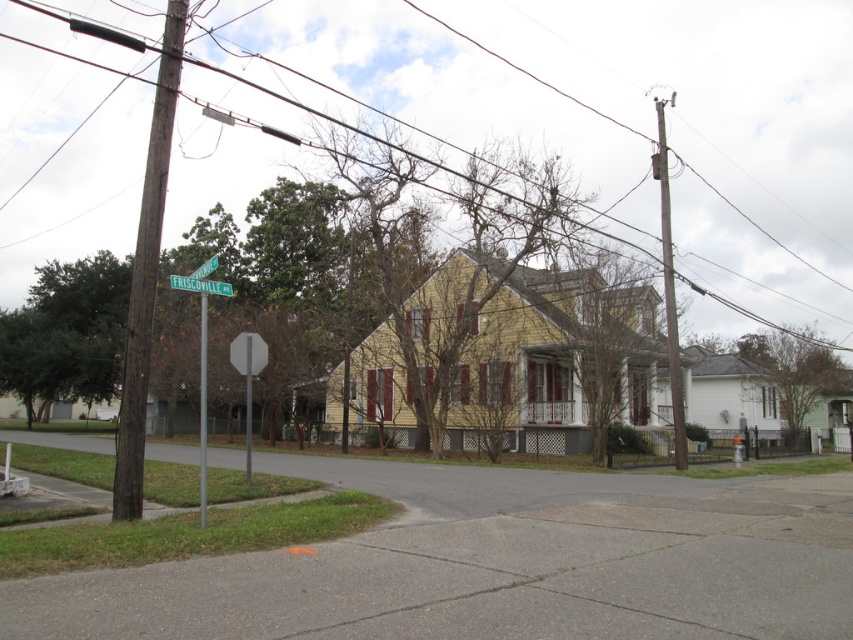
Can you confirm if brown wooden utility pole at right is shorter than green plastic street sign at upper center?

Incorrect, brown wooden utility pole at right's height does not fall short of green plastic street sign at upper center's.

Which is in front, point (666, 368) or point (169, 275)?

Point (666, 368) is in front.

Which is behind, point (660, 125) or point (228, 284)?

The point (660, 125) is more distant.

The height and width of the screenshot is (640, 853). I want to click on brown wooden utility pole at right, so click(x=669, y=289).

Is brown wooden pole at left to the right of green metal street sign at left from the viewer's perspective?

In fact, brown wooden pole at left is to the left of green metal street sign at left.

Looking at this image, who is more distant from viewer, (x=115, y=502) or (x=189, y=282)?

Positioned behind is point (x=115, y=502).

Is point (157, 97) farther from viewer compared to point (201, 272)?

Yes.

Locate an element on the screen. This screenshot has height=640, width=853. brown wooden pole at left is located at coordinates (146, 275).

Consider the image. Can you confirm if smooth wire at upper center is positioned to the right of brown wooden utility pole at right?

Incorrect, smooth wire at upper center is not on the right side of brown wooden utility pole at right.

The image size is (853, 640). What do you see at coordinates (578, 122) in the screenshot?
I see `smooth wire at upper center` at bounding box center [578, 122].

This screenshot has width=853, height=640. I want to click on smooth wire at upper center, so click(x=578, y=122).